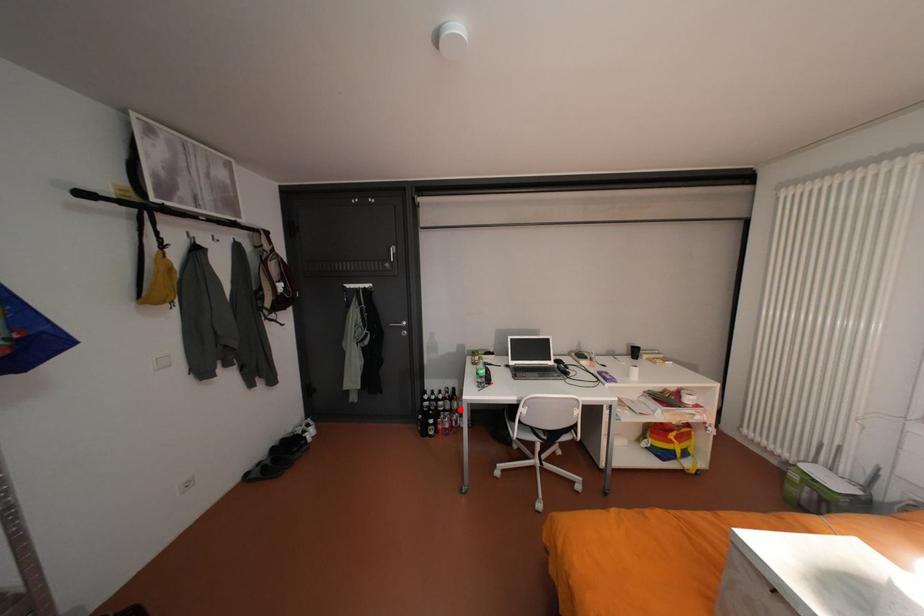
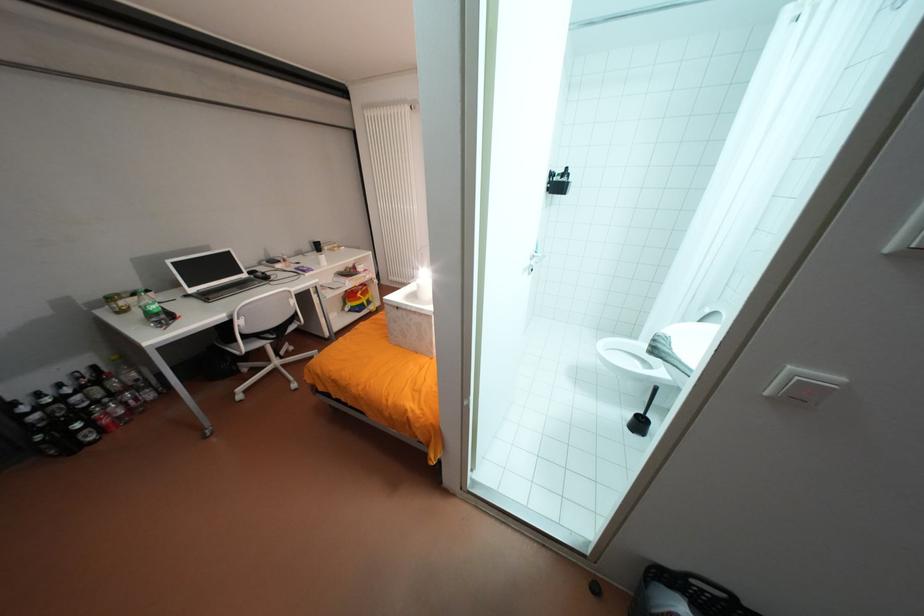
Question: I am providing you with two images of the same scene from different viewpoints. In image1, a red point is highlighted. Considering the same 3D point in image2, which of the following is correct?

Choices:
 (A) It is closer
 (B) It is farther

Answer: (A)